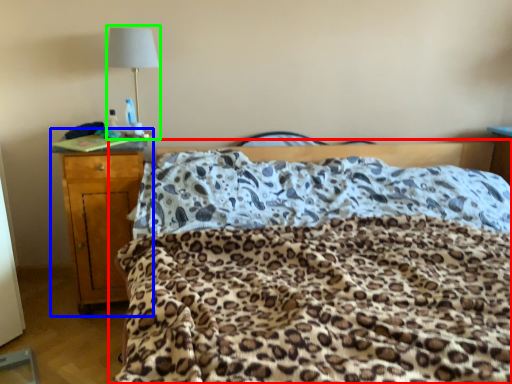
Question: Considering the real-world distances, which object is closest to bed (highlighted by a red box)? nightstand (highlighted by a blue box) or lamp (highlighted by a green box).

Choices:
 (A) nightstand
 (B) lamp

Answer: (A)